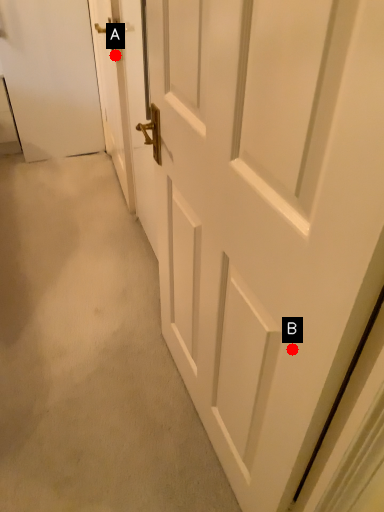
Question: Two points are circled on the image, labeled by A and B beside each circle. Which point is farther from the camera taking this photo?

Choices:
 (A) A is further
 (B) B is further

Answer: (A)